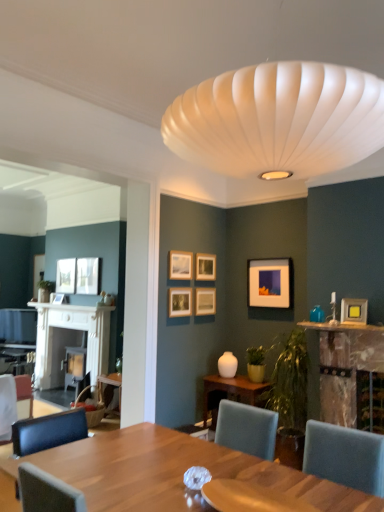
Find the location of `teal glass vase at upper right`. teal glass vase at upper right is located at coordinates (317, 314).

Image resolution: width=384 pixels, height=512 pixels. Describe the element at coordinates (70, 340) in the screenshot. I see `white wood fireplace at left, which is counted as the first fireplace, starting from the left` at that location.

What are the coordinates of `wooden picture frame at center, the 6th picture frame from the left` in the screenshot? It's located at (205, 301).

This screenshot has width=384, height=512. Identify the location of matte wooden picture frame at upper center, arranged as the third picture frame when viewed from the front. (180, 265).

Considering the sizes of objects matte wooden picture frame at upper center, placed as the 5th picture frame when sorted from left to right, and white fabric chair at lower left in the image provided, who is thinner, matte wooden picture frame at upper center, placed as the 5th picture frame when sorted from left to right, or white fabric chair at lower left?

With smaller width is matte wooden picture frame at upper center, placed as the 5th picture frame when sorted from left to right.

From the image's perspective, does matte wooden picture frame at upper center, placed as the fifth picture frame when sorted from right to left, appear higher than white fabric chair at lower left?

Correct, matte wooden picture frame at upper center, placed as the fifth picture frame when sorted from right to left, appears higher than white fabric chair at lower left in the image.

Is matte wooden picture frame at upper center, placed as the fifth picture frame when sorted from right to left, next to white fabric chair at lower left?

No, matte wooden picture frame at upper center, placed as the fifth picture frame when sorted from right to left, is not beside white fabric chair at lower left.

Does point (335, 362) lie behind point (51, 298)?

No, (335, 362) is closer to viewer.

Is rustic wood fireplace at right, which is the 2th fireplace from back to front, directly adjacent to matte black picture frame at left, placed as the 9th picture frame when sorted from front to back?

rustic wood fireplace at right, which is the 2th fireplace from back to front, is not next to matte black picture frame at left, placed as the 9th picture frame when sorted from front to back, and they're not touching.

Based on their sizes in the image, would you say rustic wood fireplace at right, marked as the 2th fireplace in a left-to-right arrangement, is bigger or smaller than matte black picture frame at left, positioned as the 1th picture frame in back-to-front order?

rustic wood fireplace at right, marked as the 2th fireplace in a left-to-right arrangement, is bigger than matte black picture frame at left, positioned as the 1th picture frame in back-to-front order.

From a real-world perspective, which is physically above, rustic wood fireplace at right, which is the 2th fireplace from back to front, or matte black picture frame at left, placed as the 9th picture frame when sorted from front to back?

From a 3D spatial view, matte black picture frame at left, placed as the 9th picture frame when sorted from front to back, is above.

Where is `the 5th picture frame counting from the right of the matte white picture frame at upper left, acting as the 7th picture frame starting from the right`? the 5th picture frame counting from the right of the matte white picture frame at upper left, acting as the 7th picture frame starting from the right is located at coordinates (270, 283).

Considering the relative positions of matte wooden picture frame at center-right, placed as the 2th picture frame when sorted from right to left, and matte white picture frame at upper left, acting as the third picture frame starting from the left, in the image provided, is matte wooden picture frame at center-right, placed as the 2th picture frame when sorted from right to left, to the left or to the right of matte white picture frame at upper left, acting as the third picture frame starting from the left,?

matte wooden picture frame at center-right, placed as the 2th picture frame when sorted from right to left, is to the right of matte white picture frame at upper left, acting as the third picture frame starting from the left.

Are matte wooden picture frame at center-right, marked as the 4th picture frame in a front-to-back arrangement, and matte white picture frame at upper left, which is the third picture frame in back-to-front order, making contact?

matte wooden picture frame at center-right, marked as the 4th picture frame in a front-to-back arrangement, is not next to matte white picture frame at upper left, which is the third picture frame in back-to-front order, and they're not touching.

Is matte wooden picture frame at center-right, placed as the 2th picture frame when sorted from right to left, shorter than matte white picture frame at upper left, the 7th picture frame viewed from the front?

Yes.

Can you confirm if matte black picture frame at left, placed as the 9th picture frame when sorted from front to back, is smaller than matte wooden picture frame at center-right, placed as the 6th picture frame when sorted from back to front?

Correct, matte black picture frame at left, placed as the 9th picture frame when sorted from front to back, occupies less space than matte wooden picture frame at center-right, placed as the 6th picture frame when sorted from back to front.

How far apart are matte black picture frame at left, positioned as the 1th picture frame in back-to-front order, and matte wooden picture frame at center-right, placed as the 2th picture frame when sorted from right to left?

matte black picture frame at left, positioned as the 1th picture frame in back-to-front order, and matte wooden picture frame at center-right, placed as the 2th picture frame when sorted from right to left, are 3.37 meters apart from each other.

From the image's perspective, is matte black picture frame at left, positioned as the 1th picture frame in back-to-front order, positioned above or below matte wooden picture frame at center-right, placed as the 6th picture frame when sorted from back to front?

matte black picture frame at left, positioned as the 1th picture frame in back-to-front order, is situated lower than matte wooden picture frame at center-right, placed as the 6th picture frame when sorted from back to front, in the image.

Considering the relative sizes of matte black picture frame at left, the 9th picture frame viewed from the right, and matte wooden picture frame at center-right, placed as the 6th picture frame when sorted from back to front, in the image provided, is matte black picture frame at left, the 9th picture frame viewed from the right, thinner than matte wooden picture frame at center-right, placed as the 6th picture frame when sorted from back to front,?

Incorrect, the width of matte black picture frame at left, the 9th picture frame viewed from the right, is not less than that of matte wooden picture frame at center-right, placed as the 6th picture frame when sorted from back to front.

Considering the sizes of matte wooden picture frame at center-right, marked as the 4th picture frame in a front-to-back arrangement, and matte wooden picture frame at upper center, arranged as the third picture frame when viewed from the front, in the image, is matte wooden picture frame at center-right, marked as the 4th picture frame in a front-to-back arrangement, bigger or smaller than matte wooden picture frame at upper center, arranged as the third picture frame when viewed from the front,?

In the image, matte wooden picture frame at center-right, marked as the 4th picture frame in a front-to-back arrangement, appears to be larger than matte wooden picture frame at upper center, arranged as the third picture frame when viewed from the front.

From the image's perspective, is matte wooden picture frame at center-right, placed as the 2th picture frame when sorted from right to left, under matte wooden picture frame at upper center, placed as the 5th picture frame when sorted from left to right?

Yes.

Can you tell me how much matte wooden picture frame at center-right, marked as the 8th picture frame in a left-to-right arrangement, and matte wooden picture frame at upper center, arranged as the third picture frame when viewed from the front, differ in facing direction?

They differ by 91.4 degrees in their facing directions.

Could you tell me if matte wooden picture frame at center-right, marked as the 4th picture frame in a front-to-back arrangement, is facing matte wooden picture frame at upper center, arranged as the third picture frame when viewed from the front?

No, matte wooden picture frame at center-right, marked as the 4th picture frame in a front-to-back arrangement, is not aimed at matte wooden picture frame at upper center, arranged as the third picture frame when viewed from the front.

Which of these two, matte black picture frame at upper left, placed as the 8th picture frame when sorted from right to left, or matte wooden picture frame at upper center, which is the 6th picture frame from front to back, is wider?

matte black picture frame at upper left, placed as the 8th picture frame when sorted from right to left.

Considering the positions of objects matte black picture frame at upper left, the second picture frame positioned from the back, and matte wooden picture frame at upper center, the third picture frame in the right-to-left sequence, in the image provided, who is more to the right, matte black picture frame at upper left, the second picture frame positioned from the back, or matte wooden picture frame at upper center, the third picture frame in the right-to-left sequence,?

From the viewer's perspective, matte wooden picture frame at upper center, the third picture frame in the right-to-left sequence, appears more on the right side.

Considering the positions of point (66, 263) and point (213, 264), is point (66, 263) closer or farther from the camera than point (213, 264)?

Point (66, 263).

Considering the sizes of objects matte black picture frame at upper left, which is the second picture frame in left-to-right order, and matte black picture frame at center, positioned as the 8th picture frame in back-to-front order, in the image provided, who is wider, matte black picture frame at upper left, which is the second picture frame in left-to-right order, or matte black picture frame at center, positioned as the 8th picture frame in back-to-front order,?

With larger width is matte black picture frame at upper left, which is the second picture frame in left-to-right order.

From the image's perspective, is matte black picture frame at upper left, positioned as the eighth picture frame in front-to-back order, on top of matte black picture frame at center, arranged as the 6th picture frame when viewed from the right?

Indeed, from the image's perspective, matte black picture frame at upper left, positioned as the eighth picture frame in front-to-back order, is shown above matte black picture frame at center, arranged as the 6th picture frame when viewed from the right.

Find the location of a particular element. the 6th picture frame in front of the matte black picture frame at upper left, which is the second picture frame in left-to-right order is located at coordinates (180, 302).

Can you confirm if matte black picture frame at upper left, which is the second picture frame in left-to-right order, is shorter than matte black picture frame at center, arranged as the 6th picture frame when viewed from the right?

No.

Image resolution: width=384 pixels, height=512 pixels. Find the location of `chair below the matte wooden picture frame at upper center, placed as the 5th picture frame when sorted from left to right (from the image's perspective)`. chair below the matte wooden picture frame at upper center, placed as the 5th picture frame when sorted from left to right (from the image's perspective) is located at coordinates (7, 407).

Starting from the rustic wood fireplace at right, positioned as the 1th fireplace in front-to-back order, which picture frame is the 9th one behind? Please provide its 2D coordinates.

[(58, 298)]

Which object lies nearer to the anchor point matte yellow picture frame at upper right, the 9th picture frame from the left, wooden table at center or wooden picture frame at center, the fifth picture frame from the front?

wooden table at center is positioned closer to the anchor matte yellow picture frame at upper right, the 9th picture frame from the left.

From the image, which object appears to be nearer to white wood fireplace at left, arranged as the 2th fireplace when viewed from the right, matte white picture frame at upper left, which is the third picture frame in back-to-front order, or matte black picture frame at left, the first picture frame from the left?

matte black picture frame at left, the first picture frame from the left, is closer to white wood fireplace at left, arranged as the 2th fireplace when viewed from the right.

Looking at the image, which one is located further to wooden table at center, matte wooden picture frame at upper center, which is the 6th picture frame from front to back, or matte wooden picture frame at upper center, marked as the 7th picture frame in a back-to-front arrangement?

matte wooden picture frame at upper center, marked as the 7th picture frame in a back-to-front arrangement, is positioned further to the anchor wooden table at center.

When comparing their distances from wooden armchair at lower left, does wooden picture frame at center, the fifth picture frame from the front, or rustic wood fireplace at right, positioned as the 1th fireplace in front-to-back order, seem closer?

wooden picture frame at center, the fifth picture frame from the front.

Considering their positions, is teal glass vase at upper right positioned further to wooden picture frame at center, the 6th picture frame from the left, than rustic wood fireplace at right, positioned as the 1th fireplace in front-to-back order?

rustic wood fireplace at right, positioned as the 1th fireplace in front-to-back order.

From the image, which object appears to be nearer to matte yellow picture frame at upper right, the ninth picture frame positioned from the back, wooden picture frame at center, the fifth picture frame from the front, or white wood fireplace at left, the 1th fireplace viewed from the back?

wooden picture frame at center, the fifth picture frame from the front, is positioned closer to the anchor matte yellow picture frame at upper right, the ninth picture frame positioned from the back.

From the image, which object appears to be nearer to matte black picture frame at center, arranged as the 6th picture frame when viewed from the right, matte white picture frame at upper left, the 7th picture frame viewed from the front, or matte yellow picture frame at upper right, the ninth picture frame positioned from the back?

matte yellow picture frame at upper right, the ninth picture frame positioned from the back.

Looking at the image, which one is located closer to wooden picture frame at center, the fifth picture frame from the front, rustic wood fireplace at right, the first fireplace positioned from the right, or matte wooden picture frame at upper center, which ranks as the 4th picture frame in back-to-front order?

Based on the image, matte wooden picture frame at upper center, which ranks as the 4th picture frame in back-to-front order, appears to be nearer to wooden picture frame at center, the fifth picture frame from the front.

Where is `table situated between matte white picture frame at upper left, acting as the third picture frame starting from the left, and matte yellow picture frame at upper right, marked as the first picture frame in a right-to-left arrangement, from left to right`? table situated between matte white picture frame at upper left, acting as the third picture frame starting from the left, and matte yellow picture frame at upper right, marked as the first picture frame in a right-to-left arrangement, from left to right is located at coordinates (229, 393).

Identify the location of table located between matte black picture frame at left, the 9th picture frame viewed from the right, and teal glass vase at upper right in the left-right direction. (229, 393).

You are a GUI agent. You are given a task and a screenshot of the screen. Output one action in this format:
    pyautogui.click(x=<x>, y=<y>)
    Task: Click on the fireplace between matte black picture frame at center, marked as the fourth picture frame in a left-to-right arrangement, and matte black picture frame at left, placed as the 9th picture frame when sorted from front to back, in the front-back direction
    This screenshot has height=512, width=384.
    Given the screenshot: What is the action you would take?
    pyautogui.click(x=70, y=340)

This screenshot has width=384, height=512. In order to click on teal between matte wooden picture frame at center-right, marked as the 4th picture frame in a front-to-back arrangement, and wooden table at center from top to bottom in this screenshot , I will do `click(317, 314)`.